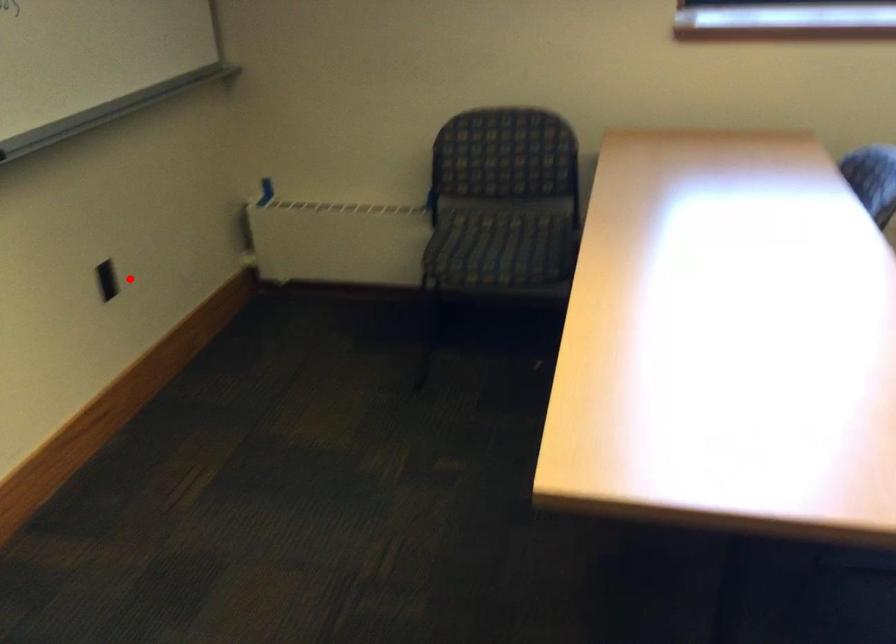
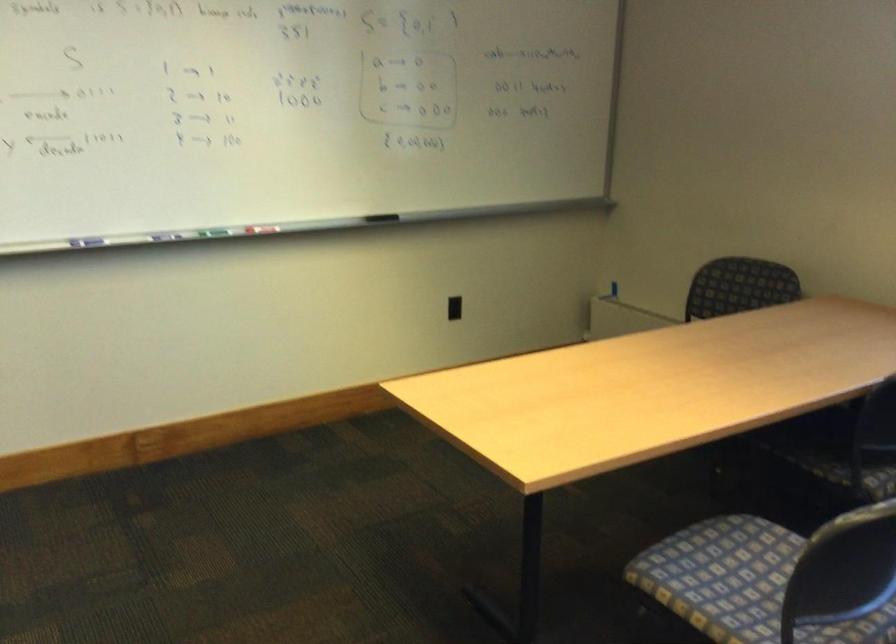
Question: A red point is marked in image1. In image2, is the corresponding 3D point closer to the camera or farther? Reply with the corresponding letter.

Choices:
 (A) The corresponding 3D point is closer.
 (B) The corresponding 3D point is farther.

Answer: (B)